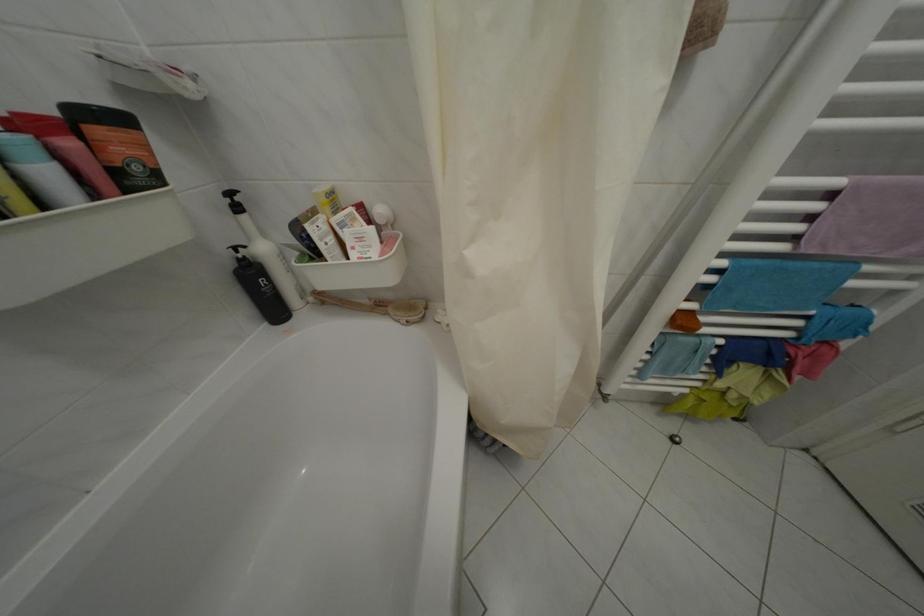
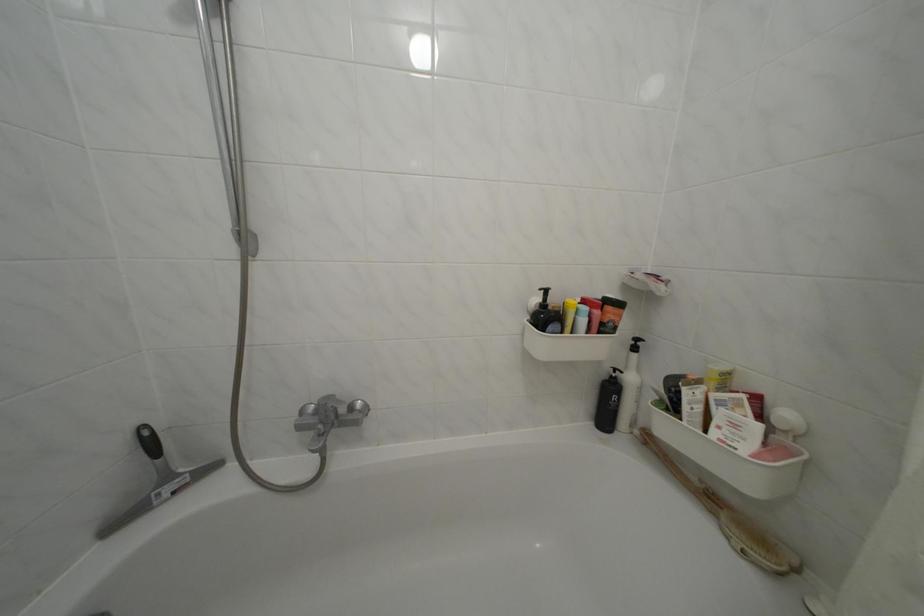
Where in the second image is the point corresponding to pixel 249 262 from the first image?

(623, 381)